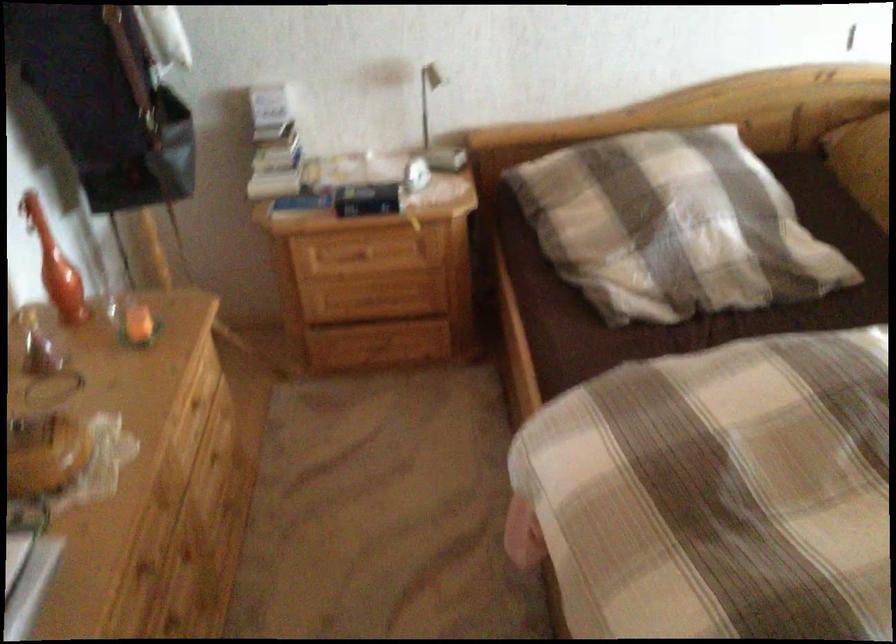
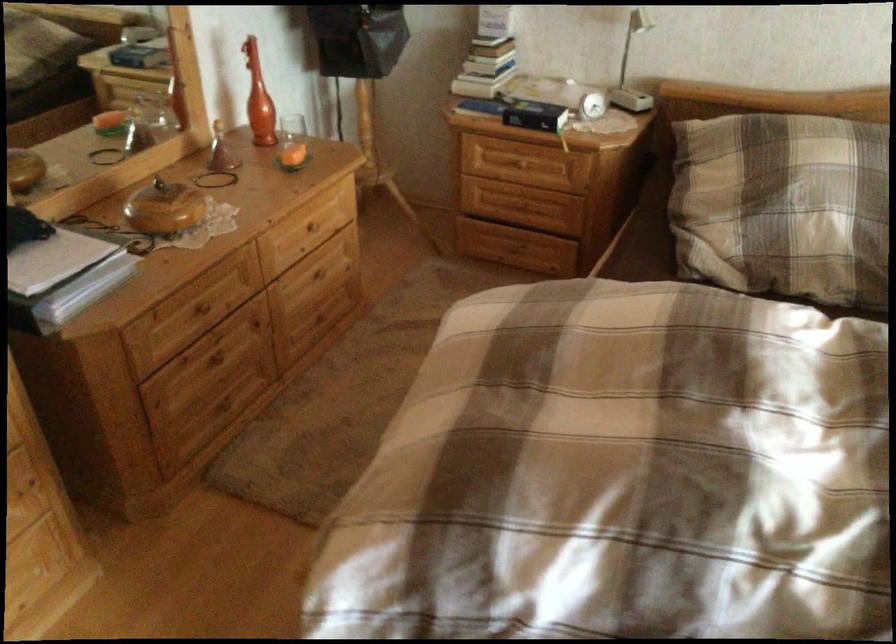
In the second image, find the point that corresponds to point 416,172 in the first image.

(587, 100)